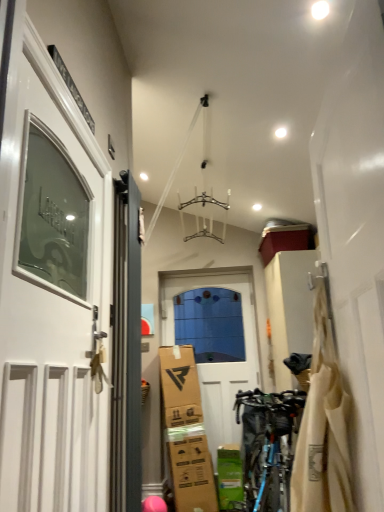
Find the location of a particular element. beige fabric bag at right is located at coordinates pos(323,428).

Describe the element at coordinates (126, 350) in the screenshot. The width and height of the screenshot is (384, 512). I see `matte gray door at left, which is counted as the second door, starting from the right` at that location.

Identify the location of green cardboard box at lower center. (229, 476).

Locate an element on the screen. Image resolution: width=384 pixels, height=512 pixels. white matte door at center, the first door positioned from the right is located at coordinates (215, 352).

This screenshot has width=384, height=512. What do you see at coordinates (268, 447) in the screenshot?
I see `blue metallic bicycle at lower right` at bounding box center [268, 447].

Where is `white glossy door at left, the 3th door positioned from the right`? The width and height of the screenshot is (384, 512). white glossy door at left, the 3th door positioned from the right is located at coordinates (53, 314).

Between point (135, 446) and point (229, 464), which one is positioned in front?

Positioned in front is point (135, 446).

Is the depth of matte gray door at left, the second door viewed from the back, less than that of green cardboard box at lower center?

Yes, the depth of matte gray door at left, the second door viewed from the back, is less than that of green cardboard box at lower center.

Looking at this image, from a real-world perspective, is matte gray door at left, the second door viewed from the back, on top of green cardboard box at lower center?

Indeed, from a real-world perspective, matte gray door at left, the second door viewed from the back, stands above green cardboard box at lower center.

Looking at the image, does matte gray door at left, marked as the second door in a left-to-right arrangement, seem bigger or smaller compared to green cardboard box at lower center?

Clearly, matte gray door at left, marked as the second door in a left-to-right arrangement, is larger in size than green cardboard box at lower center.

Which of these two, beige fabric bag at right or white glossy door at left, the first door viewed from the front, is smaller?

With smaller size is beige fabric bag at right.

In the scene shown: Could you measure the distance between beige fabric bag at right and white glossy door at left, marked as the 3th door in a back-to-front arrangement?

beige fabric bag at right and white glossy door at left, marked as the 3th door in a back-to-front arrangement, are 78.83 centimeters apart from each other.

Is beige fabric bag at right not within white glossy door at left, the 3th door positioned from the right?

Yes.

From the picture: Could you tell me if beige fabric bag at right is turned towards white glossy door at left, the first door viewed from the front?

Yes.

Which is more to the left, beige fabric bag at right or white matte door at center, the first door positioned from the back?

white matte door at center, the first door positioned from the back, is more to the left.

Between point (321, 317) and point (210, 423), which one is positioned behind?

The point (210, 423) is behind.

Considering the sizes of objects beige fabric bag at right and white matte door at center, the first door positioned from the right, in the image provided, who is taller, beige fabric bag at right or white matte door at center, the first door positioned from the right,?

white matte door at center, the first door positioned from the right.

From a real-world perspective, between beige fabric bag at right and white matte door at center, the first door positioned from the right, who is vertically lower?

beige fabric bag at right, from a real-world perspective.

From a real-world perspective, which door is the 1st one above the white matte door at center, the third door viewed from the front? Please provide its 2D coordinates.

[(53, 314)]

Is white glossy door at left, the first door viewed from the front, surrounded by white matte door at center, placed as the third door when sorted from left to right?

That's incorrect, white glossy door at left, the first door viewed from the front, is not inside white matte door at center, placed as the third door when sorted from left to right.

Could you tell me if white matte door at center, the first door positioned from the right, is turned towards white glossy door at left, the first door viewed from the front?

Yes, white matte door at center, the first door positioned from the right, is facing white glossy door at left, the first door viewed from the front.

Is blue metallic bicycle at lower right behind white matte door at center, the first door positioned from the back?

No.

In the scene shown: Would you say blue metallic bicycle at lower right is inside or outside white matte door at center, the first door positioned from the right?

blue metallic bicycle at lower right cannot be found inside white matte door at center, the first door positioned from the right.

Is blue metallic bicycle at lower right beside white matte door at center, the first door positioned from the back?

blue metallic bicycle at lower right and white matte door at center, the first door positioned from the back, are not in contact.

Is blue metallic bicycle at lower right to the left or to the right of white matte door at center, the first door positioned from the back, in the image?

Based on their positions, blue metallic bicycle at lower right is located to the right of white matte door at center, the first door positioned from the back.

Between white glossy door at left, marked as the 3th door in a back-to-front arrangement, and matte gray door at left, the second door viewed from the back, which one is positioned in front?

white glossy door at left, marked as the 3th door in a back-to-front arrangement.

The image size is (384, 512). In order to click on door that is the 1st one below the matte gray door at left, marked as the second door in a left-to-right arrangement (from a real-world perspective) in this screenshot , I will do `click(53, 314)`.

From a real-world perspective, who is located higher, white glossy door at left, marked as the 3th door in a back-to-front arrangement, or matte gray door at left, marked as the second door in a left-to-right arrangement?

matte gray door at left, marked as the second door in a left-to-right arrangement, from a real-world perspective.

In the scene shown: Can you tell me how much white glossy door at left, the first door viewed from the front, and matte gray door at left, marked as the second door in a left-to-right arrangement, differ in facing direction?

There is a 0.0107-degree angle between the facing directions of white glossy door at left, the first door viewed from the front, and matte gray door at left, marked as the second door in a left-to-right arrangement.

Which of these two, beige fabric bag at right or matte gray door at left, which is counted as the second door, starting from the right, is wider?

beige fabric bag at right is wider.

Would you say beige fabric bag at right is a long distance from matte gray door at left, marked as the second door in a left-to-right arrangement?

No, beige fabric bag at right is not far away from matte gray door at left, marked as the second door in a left-to-right arrangement.

Consider the image. From a real-world perspective, does beige fabric bag at right stand above matte gray door at left, marked as the second door in a left-to-right arrangement?

No, from a real-world perspective, beige fabric bag at right is not on top of matte gray door at left, marked as the second door in a left-to-right arrangement.

Is beige fabric bag at right bigger than matte gray door at left, the second door viewed from the back?

Correct, beige fabric bag at right is larger in size than matte gray door at left, the second door viewed from the back.

From the image's perspective, which door is the 2nd one above the green cardboard box at lower center? Please provide its 2D coordinates.

[(126, 350)]

Locate an element on the screen. This screenshot has width=384, height=512. material that is below the white glossy door at left, the 1th door positioned from the left (from the image's perspective) is located at coordinates (323, 428).

Which object lies nearer to the anchor point beige fabric bag at right, white matte door at center, the first door positioned from the right, or green cardboard box at lower center?

green cardboard box at lower center lies closer to beige fabric bag at right than the other object.

From the picture: Considering their positions, is green cardboard box at lower center positioned closer to blue metallic bicycle at lower right than beige fabric bag at right?

green cardboard box at lower center is closer to blue metallic bicycle at lower right.

Looking at the image, which one is located further to green cardboard box at lower center, matte gray door at left, positioned as the 2th door in front-to-back order, or white matte door at center, placed as the third door when sorted from left to right?

matte gray door at left, positioned as the 2th door in front-to-back order.

From the picture: Based on their spatial positions, is green cardboard box at lower center or blue metallic bicycle at lower right further from beige fabric bag at right?

Among the two, green cardboard box at lower center is located further to beige fabric bag at right.

When comparing their distances from green cardboard box at lower center, does matte gray door at left, marked as the second door in a left-to-right arrangement, or beige fabric bag at right seem closer?

matte gray door at left, marked as the second door in a left-to-right arrangement, is closer to green cardboard box at lower center.

Looking at the image, which one is located closer to beige fabric bag at right, white matte door at center, the first door positioned from the right, or blue metallic bicycle at lower right?

blue metallic bicycle at lower right lies closer to beige fabric bag at right than the other object.

Which object lies nearer to the anchor point green cardboard box at lower center, blue metallic bicycle at lower right or matte gray door at left, which is counted as the second door, starting from the right?

blue metallic bicycle at lower right is positioned closer to the anchor green cardboard box at lower center.

Which object lies nearer to the anchor point green cardboard box at lower center, beige fabric bag at right or white matte door at center, placed as the third door when sorted from left to right?

white matte door at center, placed as the third door when sorted from left to right, is positioned closer to the anchor green cardboard box at lower center.

You are a GUI agent. You are given a task and a screenshot of the screen. Output one action in this format:
    pyautogui.click(x=<x>, y=<y>)
    Task: Click on the door located between beige fabric bag at right and blue metallic bicycle at lower right in the depth direction
    The image size is (384, 512).
    Given the screenshot: What is the action you would take?
    pyautogui.click(x=126, y=350)

Image resolution: width=384 pixels, height=512 pixels. Identify the location of cardboard box between beige fabric bag at right and white matte door at center, the third door viewed from the front, along the z-axis. (229, 476).

You are a GUI agent. You are given a task and a screenshot of the screen. Output one action in this format:
    pyautogui.click(x=<x>, y=<y>)
    Task: Click on the material between white glossy door at left, marked as the 3th door in a back-to-front arrangement, and matte gray door at left, marked as the second door in a left-to-right arrangement, in the front-back direction
    The height and width of the screenshot is (512, 384).
    Given the screenshot: What is the action you would take?
    pyautogui.click(x=323, y=428)

The image size is (384, 512). In order to click on cardboard box positioned between matte gray door at left, which is counted as the second door, starting from the right, and white matte door at center, the first door positioned from the right, from near to far in this screenshot , I will do `click(229, 476)`.